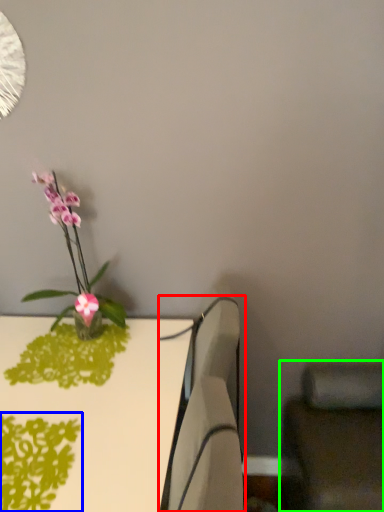
Question: Which is nearer to the swivel chair (highlighted by a red box)? plant (highlighted by a blue box) or swivel chair (highlighted by a green box).

Choices:
 (A) plant
 (B) swivel chair

Answer: (A)